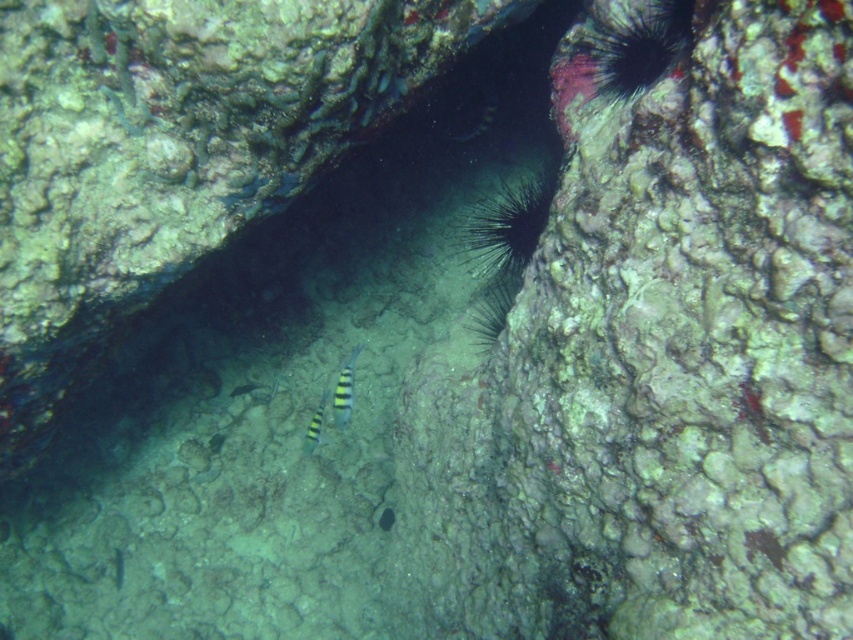
You are a marine biologist studying fish behavior in a coral reef. You notice two fish in a crevice between rocks. The fish are a multicolored striped fish at center and a striped yellow and black fish at center. Based on their positions, can you determine if they are close enough to interact with each other?

The multicolored striped fish at center and striped yellow and black fish at center are 19.81 centimeters apart. Since fish typically interact within a distance of about 20 centimeters, they are close enough to interact.